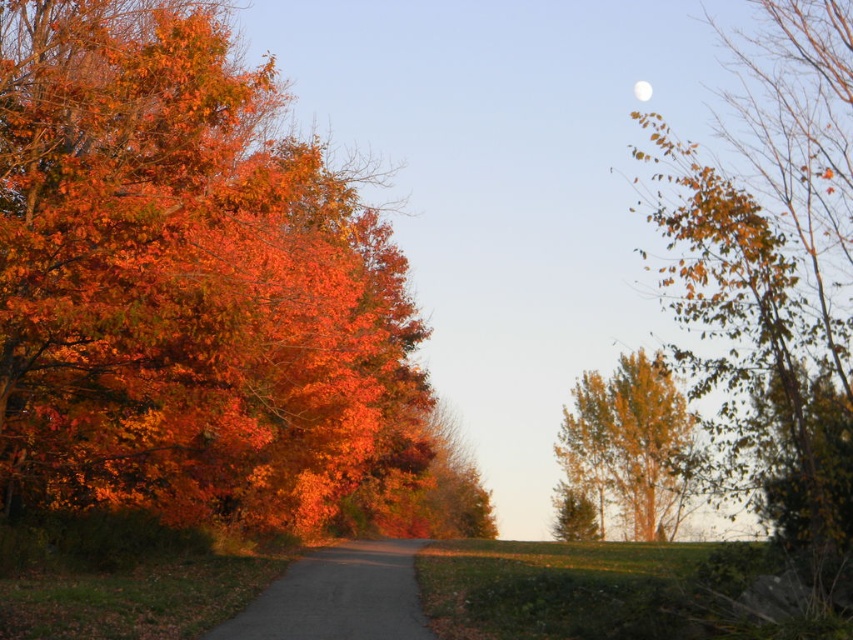
Question: Is yellow/golden wood at right positioned before white glossy moon at upper center?

Choices:
 (A) no
 (B) yes

Answer: (B)

Question: Does shiny orange leaves at left appear on the right side of yellow/golden wood at right?

Choices:
 (A) yes
 (B) no

Answer: (B)

Question: Which of these objects is positioned farthest from the dull gray asphalt road at center?

Choices:
 (A) yellow/golden wood at right
 (B) white glossy moon at upper center

Answer: (B)

Question: Estimate the real-world distances between objects in this image. Which object is farther from the yellow/golden wood at right?

Choices:
 (A) shiny orange leaves at left
 (B) dull gray asphalt road at center

Answer: (B)

Question: Does shiny orange leaves at left have a smaller size compared to yellow/golden wood at right?

Choices:
 (A) yes
 (B) no

Answer: (A)

Question: Based on their relative distances, which object is nearer to the shiny orange leaves at left?

Choices:
 (A) dull gray asphalt road at center
 (B) yellow/golden wood at right
 (C) white glossy moon at upper center

Answer: (A)